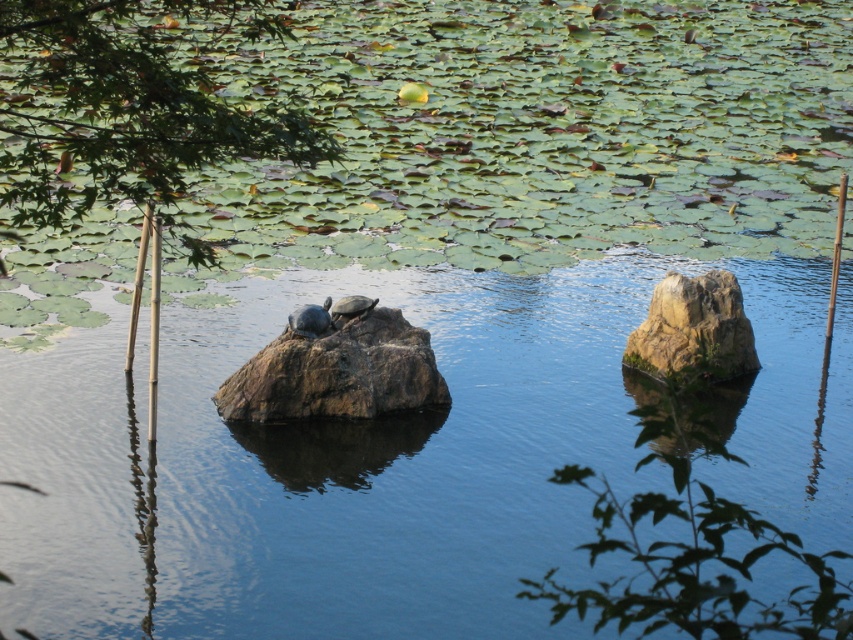
You are a photographer standing at the edge of the pond. You want to take a photo of the clear blue water at center and the green leafy tree at upper left. How far apart are these two elements in the scene?

The clear blue water at center is 8.91 meters away from the green leafy tree at upper left.

You are a small frog that can jump 5 feet. You want to jump from the smooth gray tortoise at center to the smooth beige rock at right. Will you be able to make the jump?

The smooth beige rock at right is 6.28 feet from the smooth gray tortoise at center. Since the frog can only jump 5 feet, it cannot reach the rock in a single jump.

You are a small frog that wants to jump from the smooth beige rock at right to the clear blue water at center. Considering their sizes, will you land safely without overshooting the water?

The clear blue water at center has a larger width than the smooth beige rock at right, so yes, the frog can jump safely to the clear blue water at center as there is enough space to land without overshooting.